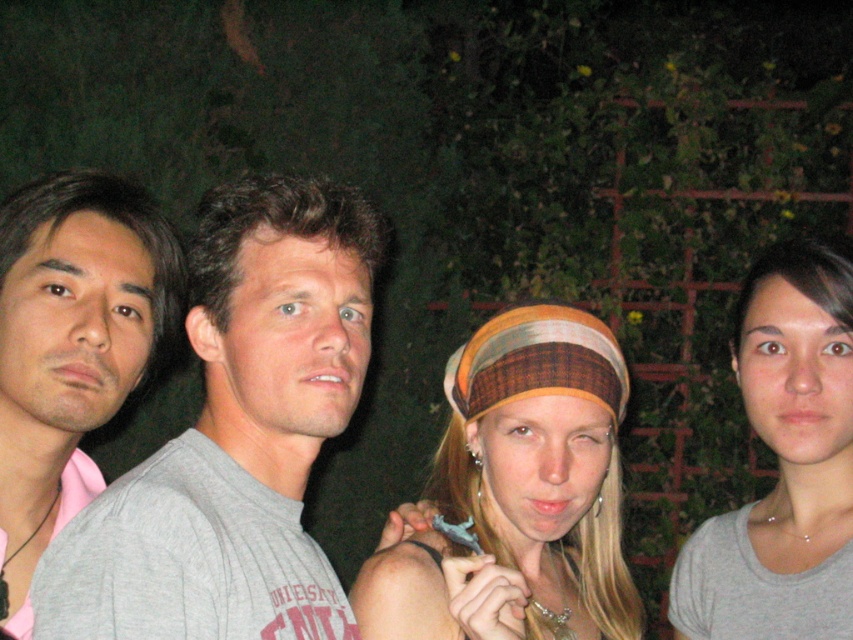
Is the position of matte gray shirt at left less distant than that of gray matte shirt at right?

Yes, it is.

Is matte gray shirt at left positioned at the back of gray matte shirt at right?

No, matte gray shirt at left is in front of gray matte shirt at right.

Measure the distance between matte gray shirt at left and camera.

3.75 feet

This screenshot has height=640, width=853. I want to click on matte gray shirt at left, so click(x=71, y=344).

Does multicolored fabric headband at center appear on the right side of gray matte shirt at right?

→ Incorrect, multicolored fabric headband at center is not on the right side of gray matte shirt at right.

Which is in front, point (605, 636) or point (799, 509)?

Point (605, 636) is in front.

Identify the location of multicolored fabric headband at center. This screenshot has width=853, height=640. (515, 493).

Is the position of multicolored fabric headband at center less distant than that of matte gray shirt at left?

Yes.

Is multicolored fabric headband at center to the right of matte gray shirt at left from the viewer's perspective?

Correct, you'll find multicolored fabric headband at center to the right of matte gray shirt at left.

The width and height of the screenshot is (853, 640). What do you see at coordinates (515, 493) in the screenshot?
I see `multicolored fabric headband at center` at bounding box center [515, 493].

The image size is (853, 640). In order to click on multicolored fabric headband at center in this screenshot , I will do `click(515, 493)`.